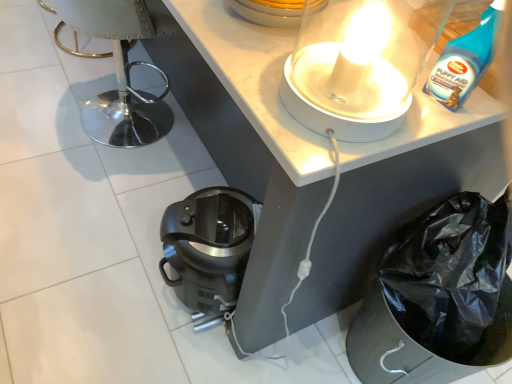
The width and height of the screenshot is (512, 384). Identify the location of vacant region under metallic silver swivel chair at left (from a real-world perspective). (x=96, y=114).